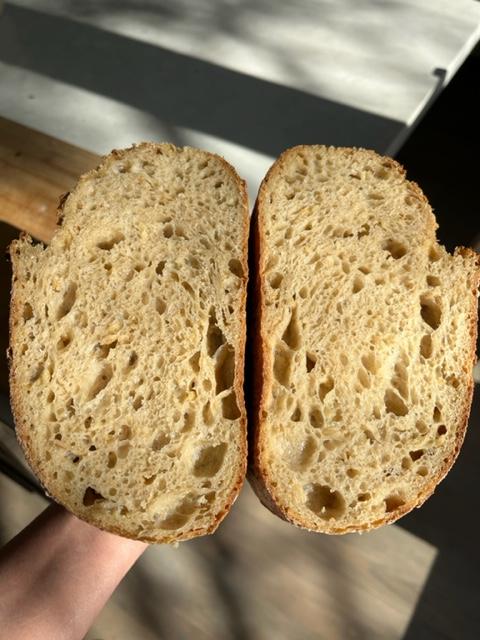
Identify the location of table. (80, 108), (355, 41).